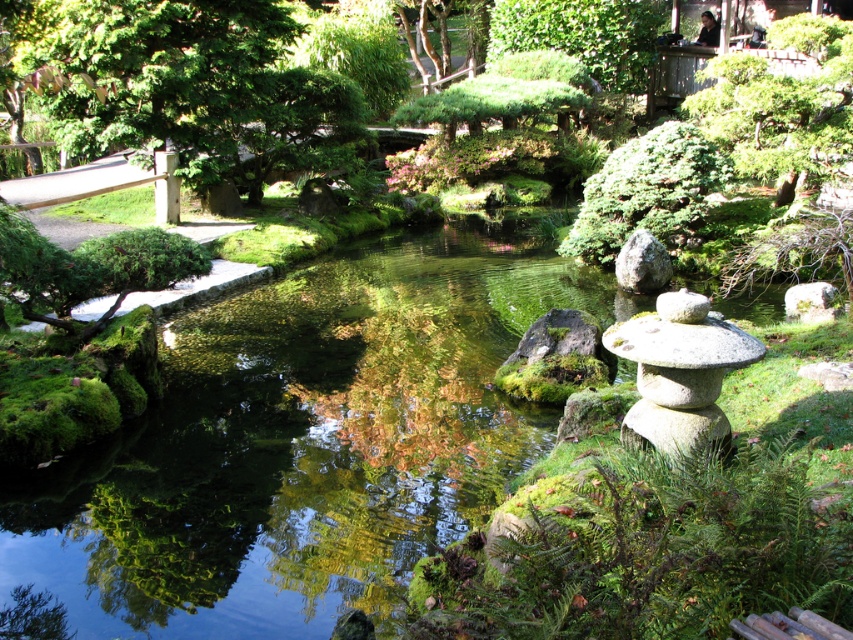
You are a visitor in the Japanese garden and want to take a photo of the green textured tree at upper right and the gray rough rock at center. Which object should you focus on first if you want to capture both in the frame without moving the camera?

The green textured tree at upper right is positioned on the right side of the gray rough rock at center, so you should focus on the gray rough rock at center first to ensure both are in the frame.

Consider the image. You are a visitor in the Japanese garden and want to take a photo of the green leafy tree at upper left and the gray rough rock at center. Which object should you focus on first if you want to capture both in your camera frame?

The green leafy tree at upper left is above the gray rough rock at center, so you should focus on the gray rough rock at center first to ensure both are in the frame.